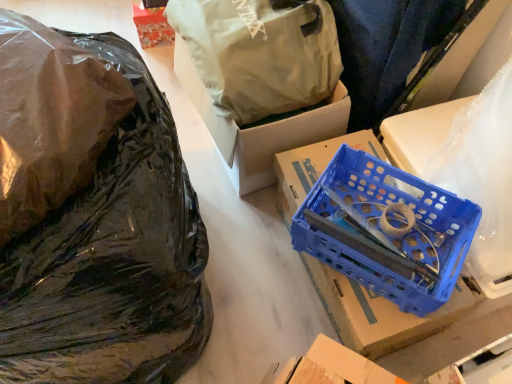
What do you see at coordinates (98, 231) in the screenshot? I see `black plastic bag at left, positioned as the 1th plastic bag in bottom-to-top order` at bounding box center [98, 231].

In order to click on white cardboard box at upper center, the 2th box viewed from the front in this screenshot , I will do `click(259, 129)`.

What do you see at coordinates (378, 313) in the screenshot? The width and height of the screenshot is (512, 384). I see `blue plastic crate at center-right, positioned as the 1th box in front-to-back order` at bounding box center [378, 313].

Locate an element on the screen. blue plastic crate at center-right, positioned as the 1th box in front-to-back order is located at coordinates (378, 313).

Find the location of a particular element. The height and width of the screenshot is (384, 512). matte white plastic bag at upper center, which ranks as the 1th plastic bag in top-to-bottom order is located at coordinates (260, 53).

The image size is (512, 384). Identify the location of the 2nd plastic bag to the right of the black plastic bag at left, which ranks as the 3th plastic bag in top-to-bottom order, starting your count from the anchor. (260, 53).

Consider the image. Would you say black plastic bag at left, which ranks as the 3th plastic bag in top-to-bottom order, is a long distance from matte white plastic bag at upper center, which ranks as the 1th plastic bag in top-to-bottom order?

No, there isn't a large distance between black plastic bag at left, which ranks as the 3th plastic bag in top-to-bottom order, and matte white plastic bag at upper center, which ranks as the 1th plastic bag in top-to-bottom order.

Consider the image. Can you confirm if black plastic bag at left, positioned as the 1th plastic bag in bottom-to-top order, is positioned to the right of matte white plastic bag at upper center, which ranks as the 1th plastic bag in top-to-bottom order?

No, black plastic bag at left, positioned as the 1th plastic bag in bottom-to-top order, is not to the right of matte white plastic bag at upper center, which ranks as the 1th plastic bag in top-to-bottom order.

In the scene shown: From the image's perspective, is black plastic bag at left, positioned as the 1th plastic bag in bottom-to-top order, located above matte white plastic bag at upper center, which ranks as the 1th plastic bag in top-to-bottom order?

Incorrect, from the image's perspective, black plastic bag at left, positioned as the 1th plastic bag in bottom-to-top order, is lower than matte white plastic bag at upper center, which ranks as the 1th plastic bag in top-to-bottom order.

Relative to white cardboard box at upper center, placed as the first box when sorted from back to front, is blue plastic crate at center-right, positioned as the 1th box in front-to-back order, in front or behind?

Visually, blue plastic crate at center-right, positioned as the 1th box in front-to-back order, is located in front of white cardboard box at upper center, placed as the first box when sorted from back to front.

Identify the location of box on the left of blue plastic crate at center-right, positioned as the 1th box in front-to-back order. The image size is (512, 384). (259, 129).

In the scene shown: Is blue plastic crate at center-right, positioned as the 1th box in front-to-back order, not near white cardboard box at upper center, the 2th box viewed from the front?

No, blue plastic crate at center-right, positioned as the 1th box in front-to-back order, is not far from white cardboard box at upper center, the 2th box viewed from the front.

Who is bigger, blue plastic crate at center-right, placed as the 2th box when sorted from back to front, or white cardboard box at upper center, the 2th box viewed from the front?

With larger size is white cardboard box at upper center, the 2th box viewed from the front.

Is black plastic bag at left, which ranks as the 3th plastic bag in top-to-bottom order, facing away from blue plastic crate at center-right, positioned as the 1th box in front-to-back order?

Yes.

Between point (14, 54) and point (356, 133), which one is positioned behind?

The point (356, 133) is more distant.

In terms of width, does black plastic bag at left, which ranks as the 3th plastic bag in top-to-bottom order, look wider or thinner when compared to blue plastic crate at center-right, positioned as the 1th box in front-to-back order?

Considering their sizes, black plastic bag at left, which ranks as the 3th plastic bag in top-to-bottom order, looks broader than blue plastic crate at center-right, positioned as the 1th box in front-to-back order.

From a real-world perspective, is black plastic bag at left, positioned as the 1th plastic bag in bottom-to-top order, above or below blue plastic crate at center-right, positioned as the 1th box in front-to-back order?

black plastic bag at left, positioned as the 1th plastic bag in bottom-to-top order, is situated lower than blue plastic crate at center-right, positioned as the 1th box in front-to-back order, in the real world.

Are blue plastic crate at center-right, placed as the 2th box when sorted from back to front, and matte white plastic bag at upper center, which is the 3th plastic bag in bottom-to-top order, beside each other?

blue plastic crate at center-right, placed as the 2th box when sorted from back to front, and matte white plastic bag at upper center, which is the 3th plastic bag in bottom-to-top order, are clearly separated.

Based on the photo, is matte white plastic bag at upper center, which ranks as the 1th plastic bag in top-to-bottom order, at the back of blue plastic crate at center-right, placed as the 2th box when sorted from back to front?

blue plastic crate at center-right, placed as the 2th box when sorted from back to front, does not have its back to matte white plastic bag at upper center, which ranks as the 1th plastic bag in top-to-bottom order.

From the image's perspective, is blue plastic crate at center-right, positioned as the 1th box in front-to-back order, located above or below matte white plastic bag at upper center, which ranks as the 1th plastic bag in top-to-bottom order?

From the image's perspective, blue plastic crate at center-right, positioned as the 1th box in front-to-back order, appears below matte white plastic bag at upper center, which ranks as the 1th plastic bag in top-to-bottom order.

Looking at this image, which of these two, blue plastic crate at center-right, placed as the 2th box when sorted from back to front, or matte white plastic bag at upper center, which ranks as the 1th plastic bag in top-to-bottom order, stands taller?

With more height is matte white plastic bag at upper center, which ranks as the 1th plastic bag in top-to-bottom order.

Does white cardboard box at upper center, placed as the first box when sorted from back to front, have a lesser width compared to transparent plastic bag at left, which appears as the second plastic bag when ordered from the bottom?

Yes.

From the image's perspective, is white cardboard box at upper center, the 2th box viewed from the front, above or below transparent plastic bag at left, placed as the second plastic bag when sorted from top to bottom?

white cardboard box at upper center, the 2th box viewed from the front, is situated higher than transparent plastic bag at left, placed as the second plastic bag when sorted from top to bottom, in the image.

Is point (192, 95) behind point (90, 88)?

Yes, point (192, 95) is farther from viewer.

From a real-world perspective, who is located higher, white cardboard box at upper center, the 2th box viewed from the front, or transparent plastic bag at left, placed as the second plastic bag when sorted from top to bottom?

transparent plastic bag at left, placed as the second plastic bag when sorted from top to bottom, from a real-world perspective.

Which object is wider, transparent plastic bag at left, which appears as the second plastic bag when ordered from the bottom, or matte white plastic bag at upper center, which is the 3th plastic bag in bottom-to-top order?

Wider between the two is transparent plastic bag at left, which appears as the second plastic bag when ordered from the bottom.

Looking at the image, does transparent plastic bag at left, which appears as the second plastic bag when ordered from the bottom, seem bigger or smaller compared to matte white plastic bag at upper center, which is the 3th plastic bag in bottom-to-top order?

transparent plastic bag at left, which appears as the second plastic bag when ordered from the bottom, is smaller than matte white plastic bag at upper center, which is the 3th plastic bag in bottom-to-top order.

From a real-world perspective, is transparent plastic bag at left, placed as the second plastic bag when sorted from top to bottom, beneath matte white plastic bag at upper center, which is the 3th plastic bag in bottom-to-top order?

Incorrect, from a real-world perspective, transparent plastic bag at left, placed as the second plastic bag when sorted from top to bottom, is higher than matte white plastic bag at upper center, which is the 3th plastic bag in bottom-to-top order.

Considering the relative sizes of transparent plastic bag at left, which appears as the second plastic bag when ordered from the bottom, and matte white plastic bag at upper center, which ranks as the 1th plastic bag in top-to-bottom order, in the image provided, is transparent plastic bag at left, which appears as the second plastic bag when ordered from the bottom, taller than matte white plastic bag at upper center, which ranks as the 1th plastic bag in top-to-bottom order,?

In fact, transparent plastic bag at left, which appears as the second plastic bag when ordered from the bottom, may be shorter than matte white plastic bag at upper center, which ranks as the 1th plastic bag in top-to-bottom order.

Locate an element on the screen. plastic bag below the transparent plastic bag at left, placed as the second plastic bag when sorted from top to bottom (from the image's perspective) is located at coordinates (98, 231).

Between point (46, 148) and point (33, 159), which one is positioned behind?

The point (46, 148) is more distant.

Is black plastic bag at left, which ranks as the 3th plastic bag in top-to-bottom order, thinner than transparent plastic bag at left, placed as the second plastic bag when sorted from top to bottom?

In fact, black plastic bag at left, which ranks as the 3th plastic bag in top-to-bottom order, might be wider than transparent plastic bag at left, placed as the second plastic bag when sorted from top to bottom.

From a real-world perspective, is black plastic bag at left, which ranks as the 3th plastic bag in top-to-bottom order, over transparent plastic bag at left, which appears as the second plastic bag when ordered from the bottom?

No, from a real-world perspective, black plastic bag at left, which ranks as the 3th plastic bag in top-to-bottom order, is not on top of transparent plastic bag at left, which appears as the second plastic bag when ordered from the bottom.

Find the location of a particular element. The height and width of the screenshot is (384, 512). the 2nd plastic bag below the matte white plastic bag at upper center, which ranks as the 1th plastic bag in top-to-bottom order (from the image's perspective) is located at coordinates pyautogui.click(x=98, y=231).

Where is `box on the right of white cardboard box at upper center, placed as the first box when sorted from back to front`? box on the right of white cardboard box at upper center, placed as the first box when sorted from back to front is located at coordinates (378, 313).

Which object lies nearer to the anchor point white cardboard box at upper center, the 2th box viewed from the front, black plastic bag at left, which ranks as the 3th plastic bag in top-to-bottom order, or blue plastic crate at center-right, placed as the 2th box when sorted from back to front?

blue plastic crate at center-right, placed as the 2th box when sorted from back to front, lies closer to white cardboard box at upper center, the 2th box viewed from the front, than the other object.

Which object lies nearer to the anchor point matte white plastic bag at upper center, which is the 3th plastic bag in bottom-to-top order, blue plastic crate at center-right, placed as the 2th box when sorted from back to front, or transparent plastic bag at left, which appears as the second plastic bag when ordered from the bottom?

blue plastic crate at center-right, placed as the 2th box when sorted from back to front, is positioned closer to the anchor matte white plastic bag at upper center, which is the 3th plastic bag in bottom-to-top order.

Looking at this image, from the image, which object appears to be farther from transparent plastic bag at left, which appears as the second plastic bag when ordered from the bottom, matte white plastic bag at upper center, which is the 3th plastic bag in bottom-to-top order, or blue plastic crate at center-right, placed as the 2th box when sorted from back to front?

blue plastic crate at center-right, placed as the 2th box when sorted from back to front, is further to transparent plastic bag at left, which appears as the second plastic bag when ordered from the bottom.

Considering their positions, is matte white plastic bag at upper center, which is the 3th plastic bag in bottom-to-top order, positioned further to blue plastic crate at center-right, placed as the 2th box when sorted from back to front, than black plastic bag at left, which ranks as the 3th plastic bag in top-to-bottom order?

The object further to blue plastic crate at center-right, placed as the 2th box when sorted from back to front, is black plastic bag at left, which ranks as the 3th plastic bag in top-to-bottom order.

Estimate the real-world distances between objects in this image. Which object is further from blue plastic crate at center-right, positioned as the 1th box in front-to-back order, transparent plastic bag at left, which appears as the second plastic bag when ordered from the bottom, or matte white plastic bag at upper center, which ranks as the 1th plastic bag in top-to-bottom order?

transparent plastic bag at left, which appears as the second plastic bag when ordered from the bottom.

Considering their positions, is blue plastic crate at center-right, placed as the 2th box when sorted from back to front, positioned further to black plastic bag at left, which ranks as the 3th plastic bag in top-to-bottom order, than matte white plastic bag at upper center, which is the 3th plastic bag in bottom-to-top order?

matte white plastic bag at upper center, which is the 3th plastic bag in bottom-to-top order, is positioned further to the anchor black plastic bag at left, which ranks as the 3th plastic bag in top-to-bottom order.

Which object lies further to the anchor point matte white plastic bag at upper center, which ranks as the 1th plastic bag in top-to-bottom order, transparent plastic bag at left, which appears as the second plastic bag when ordered from the bottom, or black plastic bag at left, positioned as the 1th plastic bag in bottom-to-top order?

The object further to matte white plastic bag at upper center, which ranks as the 1th plastic bag in top-to-bottom order, is transparent plastic bag at left, which appears as the second plastic bag when ordered from the bottom.

When comparing their distances from matte white plastic bag at upper center, which is the 3th plastic bag in bottom-to-top order, does black plastic bag at left, positioned as the 1th plastic bag in bottom-to-top order, or transparent plastic bag at left, placed as the second plastic bag when sorted from top to bottom, seem closer?

Among the two, black plastic bag at left, positioned as the 1th plastic bag in bottom-to-top order, is located nearer to matte white plastic bag at upper center, which is the 3th plastic bag in bottom-to-top order.

You are a GUI agent. You are given a task and a screenshot of the screen. Output one action in this format:
    pyautogui.click(x=<x>, y=<y>)
    Task: Click on the plastic bag between transparent plastic bag at left, which appears as the second plastic bag when ordered from the bottom, and matte white plastic bag at upper center, which is the 3th plastic bag in bottom-to-top order, from front to back
    This screenshot has width=512, height=384.
    Given the screenshot: What is the action you would take?
    pyautogui.click(x=98, y=231)

I want to click on box between matte white plastic bag at upper center, which ranks as the 1th plastic bag in top-to-bottom order, and blue plastic crate at center-right, positioned as the 1th box in front-to-back order, from top to bottom, so click(259, 129).

Locate an element on the screen. Image resolution: width=512 pixels, height=384 pixels. plastic bag between transparent plastic bag at left, which appears as the second plastic bag when ordered from the bottom, and blue plastic crate at center-right, placed as the 2th box when sorted from back to front, from left to right is located at coordinates (260, 53).

Where is `box located between black plastic bag at left, positioned as the 1th plastic bag in bottom-to-top order, and blue plastic crate at center-right, placed as the 2th box when sorted from back to front, in the left-right direction`? Image resolution: width=512 pixels, height=384 pixels. box located between black plastic bag at left, positioned as the 1th plastic bag in bottom-to-top order, and blue plastic crate at center-right, placed as the 2th box when sorted from back to front, in the left-right direction is located at coordinates (259, 129).